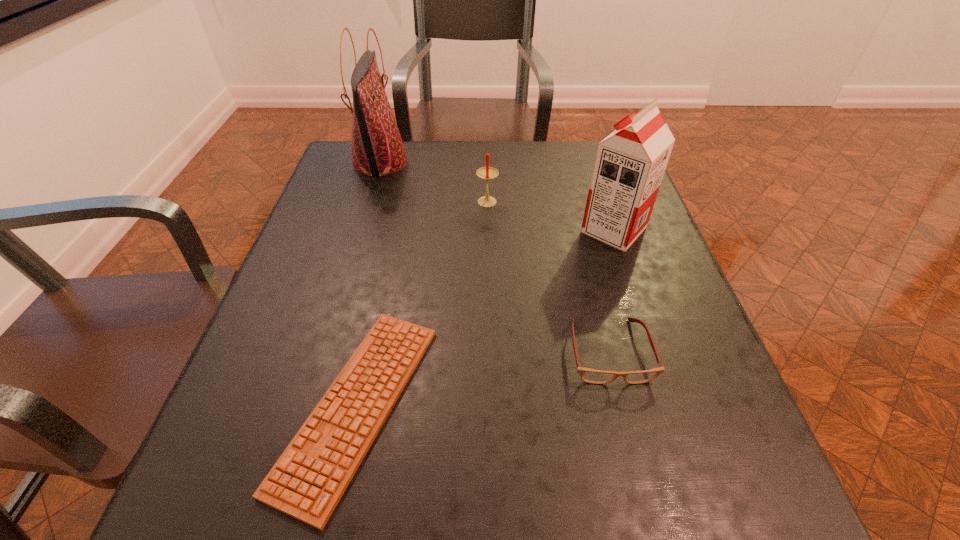
Find the location of a particular element. The height and width of the screenshot is (540, 960). vacant space situated on the right of the computer keyboard is located at coordinates (518, 404).

Image resolution: width=960 pixels, height=540 pixels. I want to click on object that is at the far edge, so click(377, 148).

I want to click on object situated at the near edge, so click(x=308, y=480).

Where is `handbag at the left edge`? The image size is (960, 540). handbag at the left edge is located at coordinates (377, 148).

At what (x,y) coordinates should I click in order to perform the action: click on computer keyboard that is positioned at the left edge. Please return your answer as a coordinate pair (x, y). Looking at the image, I should click on (308, 480).

Locate an element on the screen. soya milk at the right edge is located at coordinates (630, 163).

Where is `spectacles positioned at the right edge`? The height and width of the screenshot is (540, 960). spectacles positioned at the right edge is located at coordinates point(588,375).

What are the coordinates of `object at the far left corner` in the screenshot? It's located at (377, 148).

Locate an element on the screen. The height and width of the screenshot is (540, 960). object positioned at the near left corner is located at coordinates (308, 480).

Where is `free location at the far edge of the desktop`? free location at the far edge of the desktop is located at coordinates (567, 176).